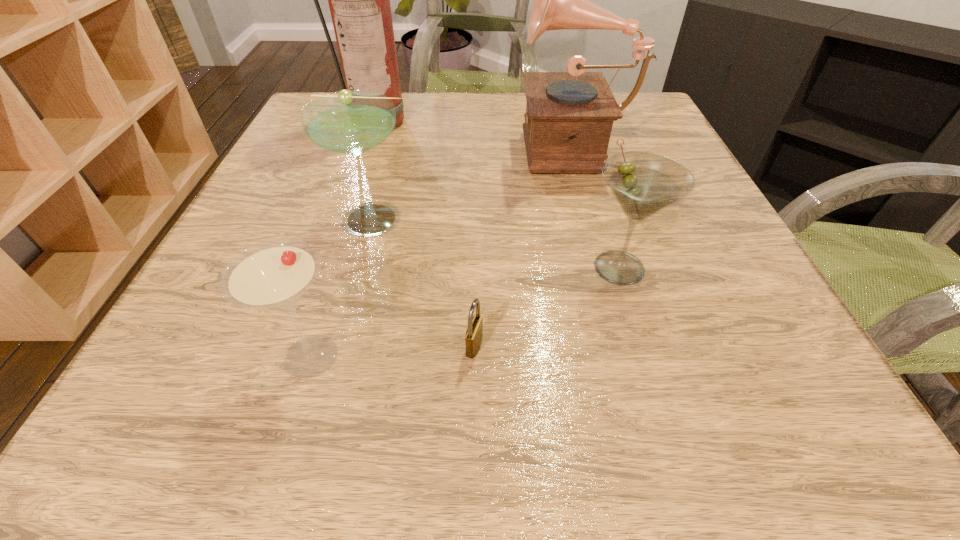
The width and height of the screenshot is (960, 540). I want to click on vacant space located on the horn of the record player, so click(x=408, y=144).

This screenshot has height=540, width=960. What are the coordinates of `vacant space situated 0.120m on the left of the rightmost martini` in the screenshot? It's located at (506, 267).

The width and height of the screenshot is (960, 540). I want to click on vacant space situated on the back of the shortest martini, so click(354, 218).

Identify the location of vacant space located 0.350m on the right of the fourth object from left to right. (742, 346).

This screenshot has height=540, width=960. Identify the location of fire extinguisher at the far edge. (359, 0).

You are a GUI agent. You are given a task and a screenshot of the screen. Output one action in this format:
    pyautogui.click(x=<x>, y=<y>)
    Task: Click on the record player positioned at the far edge
    This screenshot has height=540, width=960.
    Given the screenshot: What is the action you would take?
    569,116

This screenshot has width=960, height=540. I want to click on object present at the near edge, so click(274, 275).

Identify the location of fire extinguisher situated at the left edge. (359, 0).

Locate an element on the screen. martini that is at the left edge is located at coordinates point(274,275).

Where is `record player located at the right edge`? record player located at the right edge is located at coordinates (569, 116).